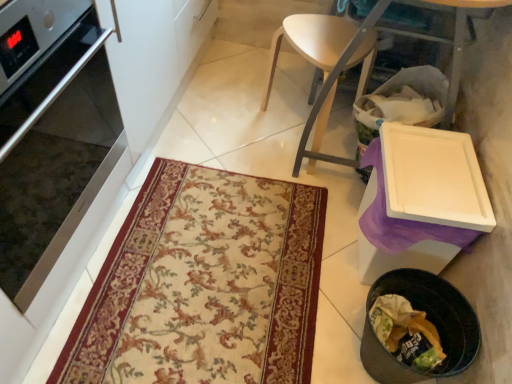
You are a GUI agent. You are given a task and a screenshot of the screen. Output one action in this format:
    pyautogui.click(x=<x>, y=<y>)
    Task: Click on the free point in front of light wood chair at center
    Image resolution: width=512 pixels, height=384 pixels.
    Given the screenshot: What is the action you would take?
    pyautogui.click(x=281, y=191)